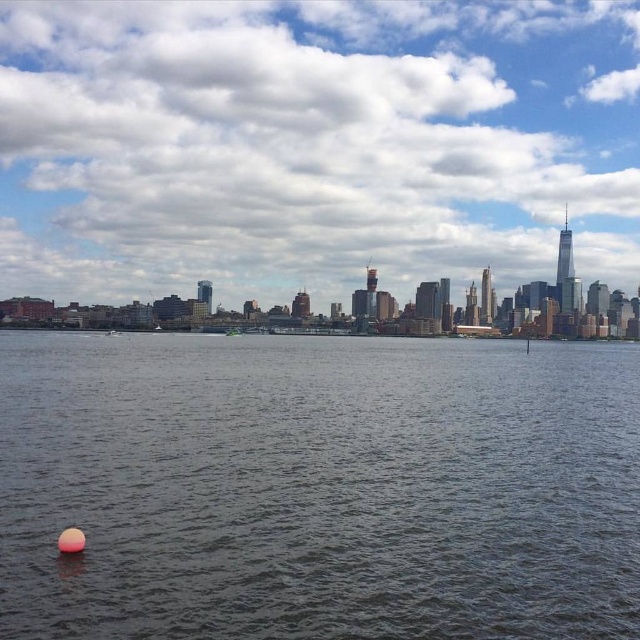
You are standing on a dock and see the dark gray water at lower left and the green plastic boat at center. Which object is closer to you?

The dark gray water at lower left is positioned under the green plastic boat at center, meaning it is closer to you.

You are a drone operator trying to capture a photo of the city skyline. You notice a point marked at coordinates (317,486) in the image. What is the object located at that point?

The point at coordinates (317,486) indicates dark gray water at lower left.

You are a drone operator planning to capture a photo of the dark gray water at lower left. The camera has a fixed focus point at coordinates point (x=317, y=486). Will the dark gray water at lower left be in focus?

The dark gray water at lower left is located at point (x=317, y=486), so yes, the dark gray water at lower left will be in focus since the camera is focused on that exact coordinate.